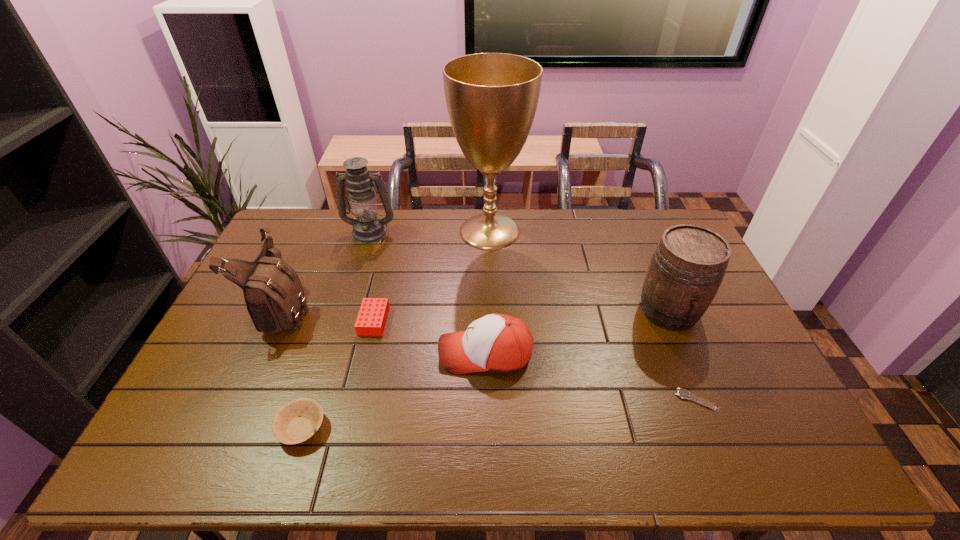
Image resolution: width=960 pixels, height=540 pixels. Identify the location of free space located on the front-facing side of the leftmost object. (388, 308).

Image resolution: width=960 pixels, height=540 pixels. Find the location of `free space located 0.200m on the side of the cider near the bung hole`. free space located 0.200m on the side of the cider near the bung hole is located at coordinates (705, 396).

Locate an element on the screen. blank area located on the front-facing side of the fifth tallest object is located at coordinates (304, 353).

Identify the location of vacant space located on the front-facing side of the fifth tallest object. (396, 353).

I want to click on vacant region located 0.300m on the front-facing side of the fifth tallest object, so click(332, 353).

Locate an element on the screen. This screenshot has width=960, height=540. free space located on the left of the Lego is located at coordinates (258, 321).

Locate an element on the screen. The height and width of the screenshot is (540, 960). blank area located on the back of the seventh tallest object is located at coordinates (340, 308).

What are the coordinates of `blank area located on the front of the shortest object` in the screenshot? It's located at tap(716, 447).

The image size is (960, 540). In order to click on trophy cup positioned at the far edge in this screenshot , I will do `click(491, 98)`.

I want to click on oil lamp that is positioned at the far edge, so click(x=368, y=227).